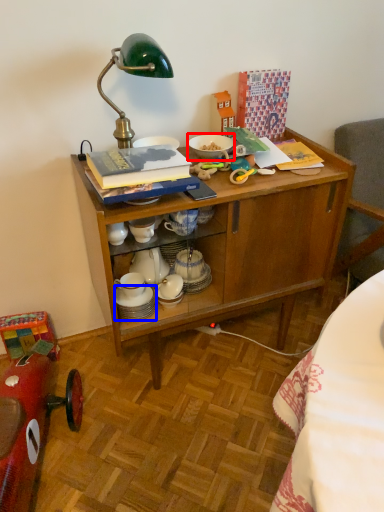
Question: Which of the following is the farthest to the observer, tableware (highlighted by a red box) or tableware (highlighted by a blue box)?

Choices:
 (A) tableware
 (B) tableware

Answer: (A)